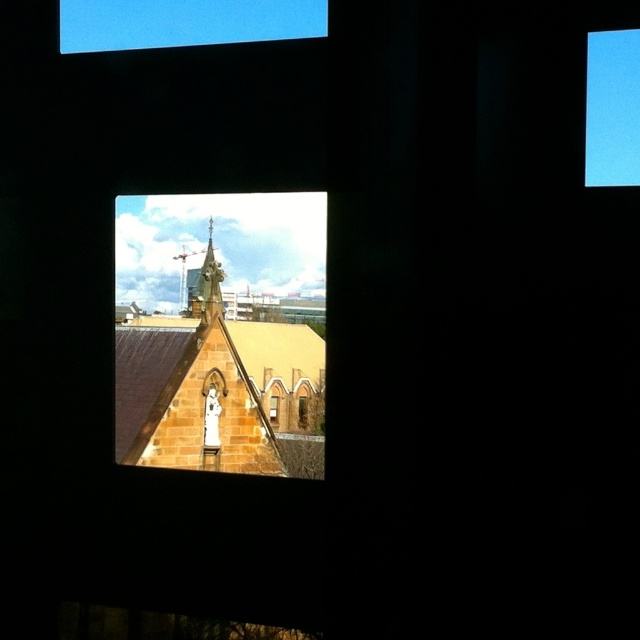
Consider the image. Does blue glass window at upper right have a greater width compared to transparent glass window at lower center?

Yes.

Is blue glass window at upper right smaller than transparent glass window at lower center?

Incorrect, blue glass window at upper right is not smaller in size than transparent glass window at lower center.

Between point (609, 147) and point (307, 417), which one is positioned behind?

The point (307, 417) is behind.

The image size is (640, 640). What are the coordinates of `blue glass window at upper right` in the screenshot? It's located at (611, 108).

Is brown stone church at center wider than clear glass window at center?

Yes.

Who is positioned more to the right, brown stone church at center or clear glass window at center?

clear glass window at center is more to the right.

Is point (186, 376) positioned in front of point (272, 419)?

Yes, it is.

Where is `brown stone church at center`? brown stone church at center is located at coordinates (214, 378).

Between point (632, 67) and point (196, 291), which one is positioned in front?

Positioned in front is point (632, 67).

Is the position of blue glass window at upper right less distant than that of gold textured spire at center?

Yes, blue glass window at upper right is in front of gold textured spire at center.

Locate an element on the screen. The image size is (640, 640). blue glass window at upper right is located at coordinates (611, 108).

Image resolution: width=640 pixels, height=640 pixels. In order to click on blue glass window at upper right in this screenshot , I will do point(611,108).